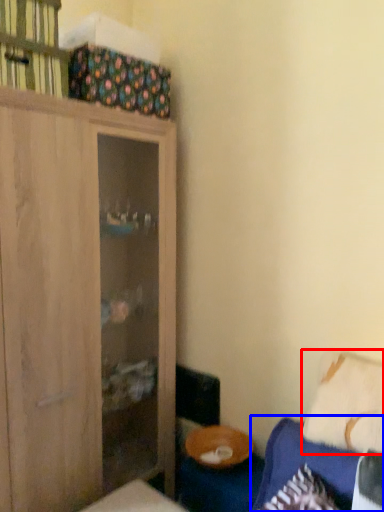
Question: Which of the following is the closest to the observer, pillow (highlighted by a red box) or couch (highlighted by a blue box)?

Choices:
 (A) pillow
 (B) couch

Answer: (B)